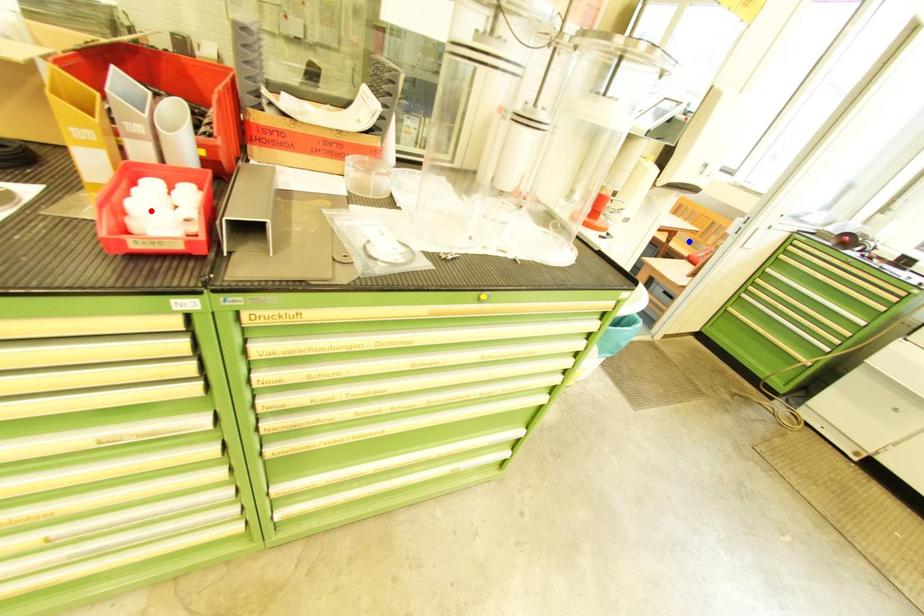
Order these from nearest to farthest:
A) blue point
B) red point
C) yellow point

red point → yellow point → blue point